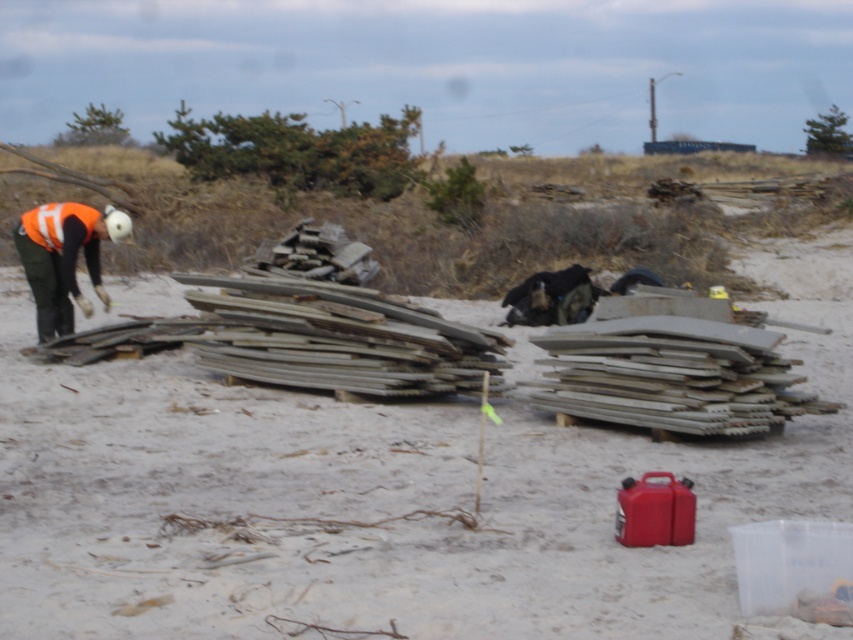
Is white sandy beach at center positioned before orange reflective vest at left?

Yes, it is in front of orange reflective vest at left.

Is point (654, 605) behind point (59, 288)?

That is False.

You are a GUI agent. You are given a task and a screenshot of the screen. Output one action in this format:
    pyautogui.click(x=<x>, y=<y>)
    Task: Click on the white sandy beach at center
    The image size is (853, 640).
    Given the screenshot: What is the action you would take?
    pyautogui.click(x=376, y=502)